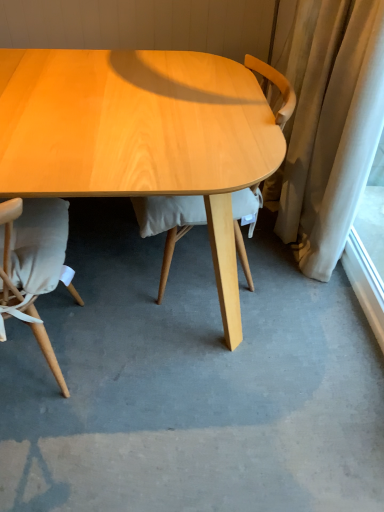
Find the location of `vacant region below matte beige chair at lower left, the 2th chair when ordered from right to left (from a real-world perspective)`. vacant region below matte beige chair at lower left, the 2th chair when ordered from right to left (from a real-world perspective) is located at coordinates pyautogui.click(x=40, y=354).